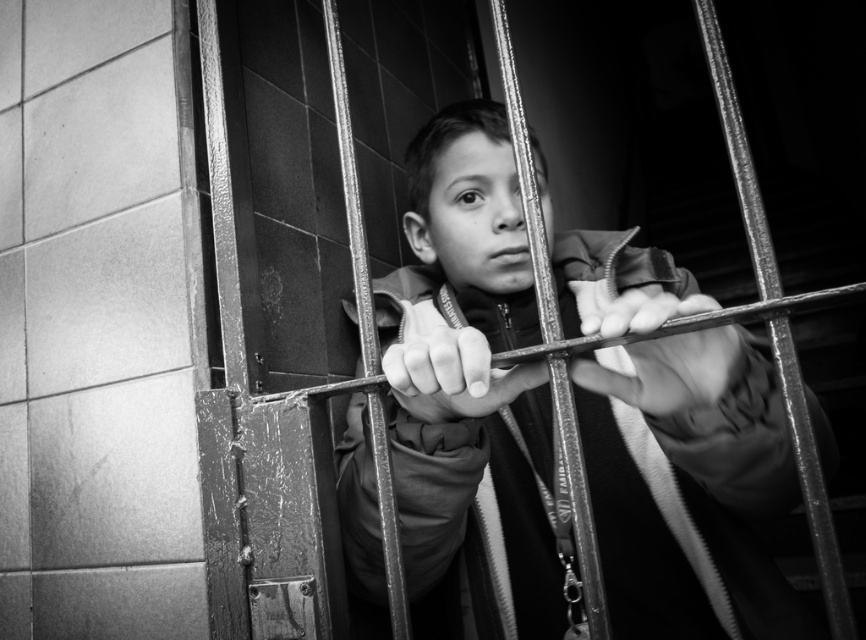
Is matte black jacket at center taller than smooth metal hand at center?

Correct, matte black jacket at center is much taller as smooth metal hand at center.

Consider the image. Who is lower down, matte black jacket at center or smooth metal hand at center?

Positioned lower is smooth metal hand at center.

This screenshot has width=866, height=640. In order to click on matte black jacket at center in this screenshot , I will do `click(470, 372)`.